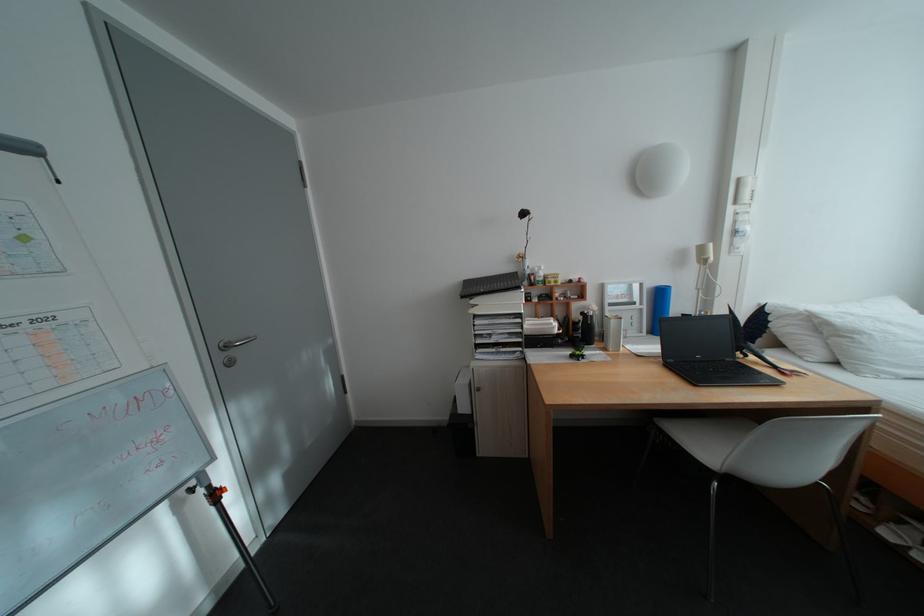
At what (x,y) coordinates should I click in order to perform the action: click on silver door handle. Please return your answer as a coordinate pair (x, y). The height and width of the screenshot is (616, 924). Looking at the image, I should click on (228, 330).